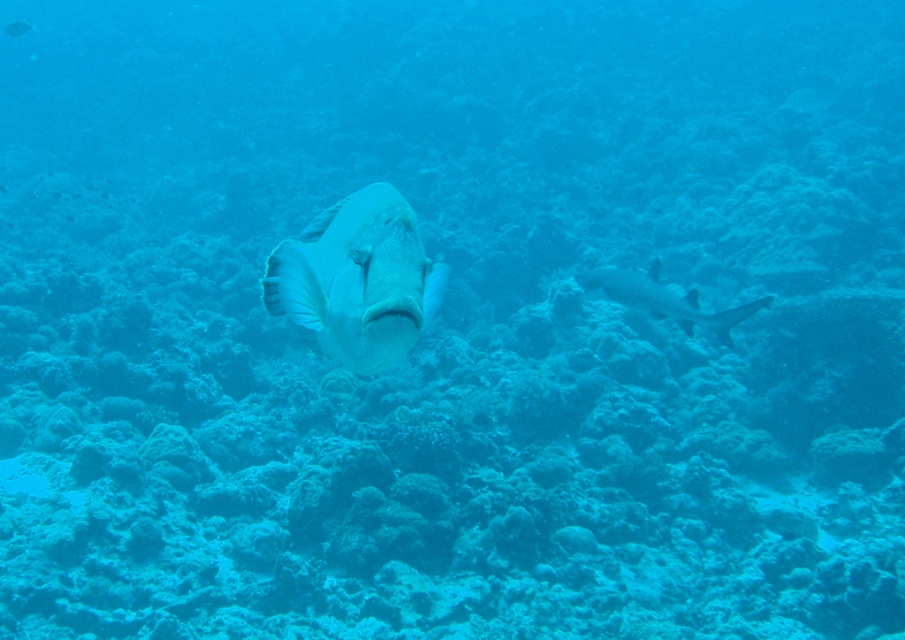
Question: Observing the image, what is the correct spatial positioning of white matte fish at center in reference to smooth gray shark at center?

Choices:
 (A) below
 (B) above

Answer: (A)

Question: Considering the relative positions of white matte fish at center and smooth gray shark at center in the image provided, where is white matte fish at center located with respect to smooth gray shark at center?

Choices:
 (A) right
 (B) left

Answer: (B)

Question: Can you confirm if white matte fish at center is smaller than smooth gray shark at center?

Choices:
 (A) yes
 (B) no

Answer: (A)

Question: Which of the following is the farthest from the observer?

Choices:
 (A) smooth gray shark at center
 (B) white matte fish at center

Answer: (A)